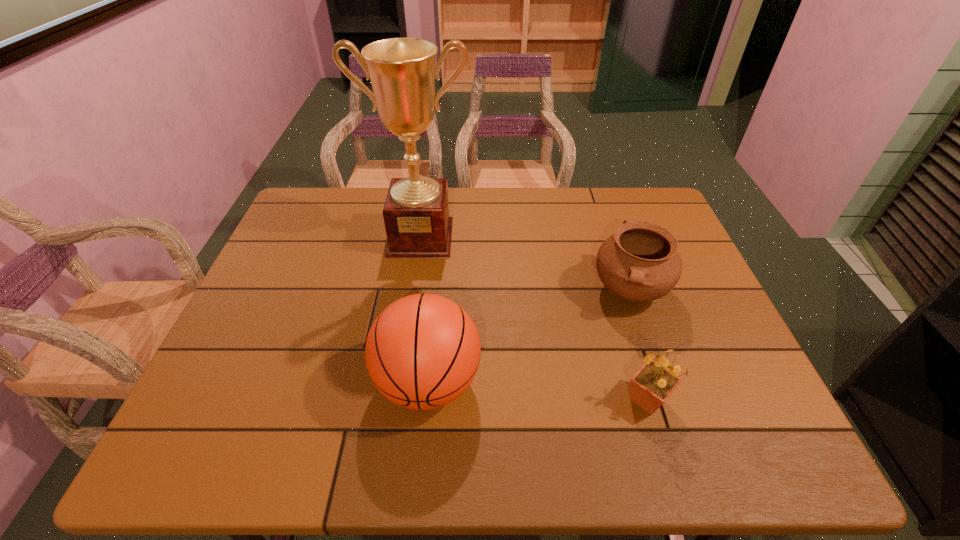
Identify the location of sunflower present at the near edge. coord(650,387).

Identify the location of object that is at the right edge. (640, 262).

In the image, there is a desktop. Identify the location of vacant region at the far edge. (362, 204).

Where is `vacant space at the near edge of the desktop`? This screenshot has height=540, width=960. vacant space at the near edge of the desktop is located at coordinates (473, 442).

Where is `vacant area at the left edge of the desktop`? vacant area at the left edge of the desktop is located at coordinates (284, 258).

Image resolution: width=960 pixels, height=540 pixels. Find the location of `free space at the right edge of the desktop`. free space at the right edge of the desktop is located at coordinates (670, 325).

You are a GUI agent. You are given a task and a screenshot of the screen. Output one action in this format:
    pyautogui.click(x=<x>, y=<y>)
    Task: Click on the free space between the third nearest object and the basketball
    Image resolution: width=960 pixels, height=540 pixels.
    Given the screenshot: What is the action you would take?
    pyautogui.click(x=529, y=336)

This screenshot has width=960, height=540. Identify the location of vacant point located between the pottery and the third shortest object. (529, 336).

Where is `vacant point located between the second farthest object and the tallest object`? The height and width of the screenshot is (540, 960). vacant point located between the second farthest object and the tallest object is located at coordinates (525, 264).

Locate an element on the screen. Image resolution: width=960 pixels, height=540 pixels. free space between the third nearest object and the sunflower is located at coordinates (638, 345).